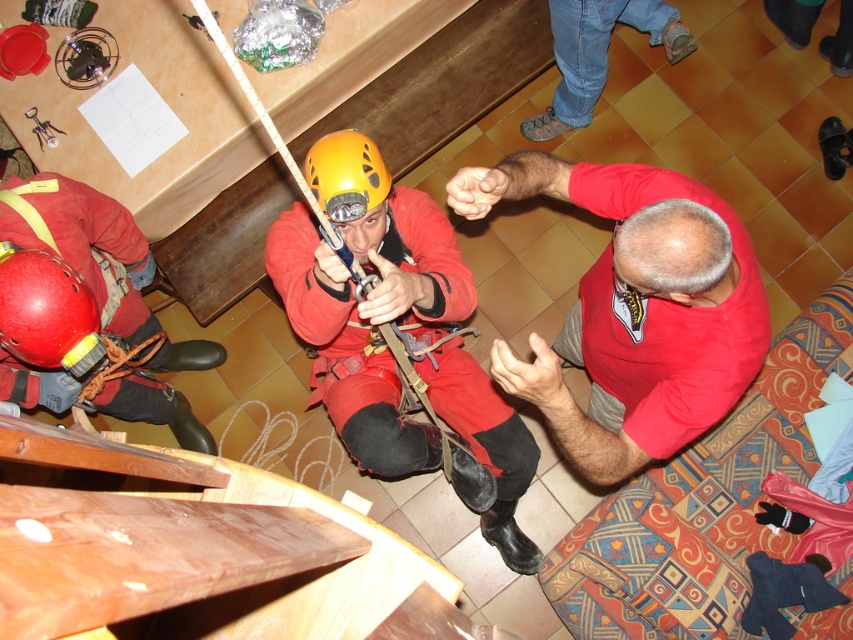
From the picture: Is red matte shirt at upper right thinner than jeans at upper center?

No, red matte shirt at upper right is not thinner than jeans at upper center.

Identify the location of red matte shirt at upper right. (636, 308).

This screenshot has height=640, width=853. In order to click on red matte shirt at upper right in this screenshot , I will do `click(636, 308)`.

Which is above, matte red climbing suit at center or yellow matte helmet at center?

yellow matte helmet at center

This screenshot has width=853, height=640. What do you see at coordinates (367, 296) in the screenshot? I see `matte red climbing suit at center` at bounding box center [367, 296].

I want to click on matte red climbing suit at center, so click(x=367, y=296).

Between jeans at upper center and yellow matte helmet at center, which one is positioned lower?

Positioned lower is yellow matte helmet at center.

Which is more to the right, jeans at upper center or yellow matte helmet at center?

Positioned to the right is jeans at upper center.

Who is more distant from viewer, (688, 40) or (338, 179)?

The point (688, 40) is behind.

This screenshot has height=640, width=853. I want to click on jeans at upper center, so click(596, 54).